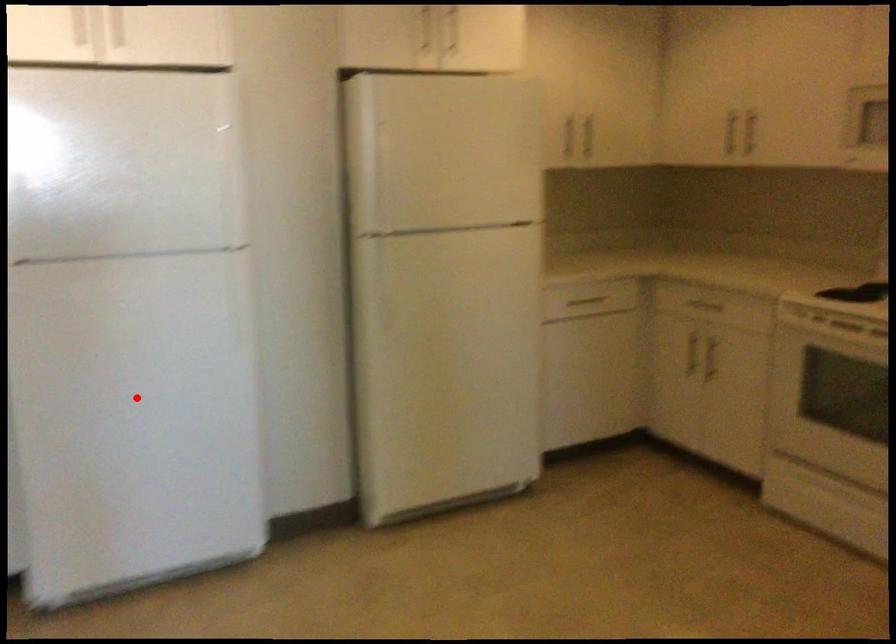
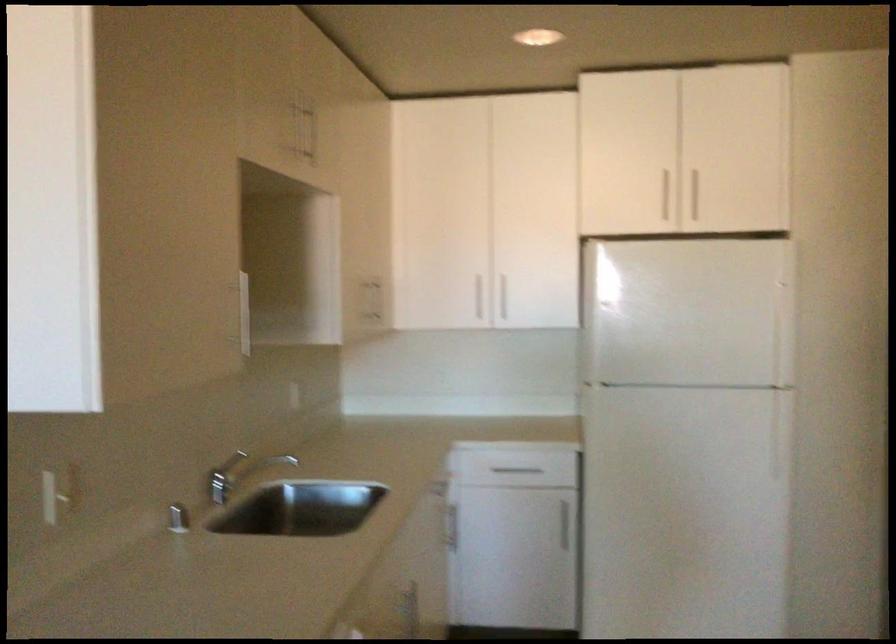
Where in the second image is the point corresponding to the highlighted location from the first image?

(685, 512)